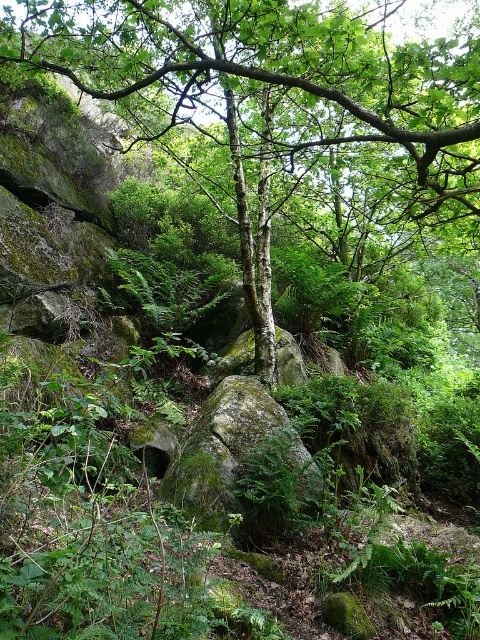
Question: Does green mossy tree at center have a larger size compared to green mossy rock at center?

Choices:
 (A) no
 (B) yes

Answer: (B)

Question: Which point appears farthest from the camera in this image?

Choices:
 (A) (339, 24)
 (B) (313, 476)

Answer: (B)

Question: Is green mossy tree at center smaller than green mossy rock at center?

Choices:
 (A) no
 (B) yes

Answer: (A)

Question: Is green mossy tree at center to the left of green mossy rock at center from the viewer's perspective?

Choices:
 (A) yes
 (B) no

Answer: (B)

Question: Among these objects, which one is nearest to the camera?

Choices:
 (A) green mossy rock at center
 (B) green mossy tree at center

Answer: (B)

Question: Which of the following is the closest to the observer?

Choices:
 (A) (217, 420)
 (B) (357, 29)

Answer: (B)